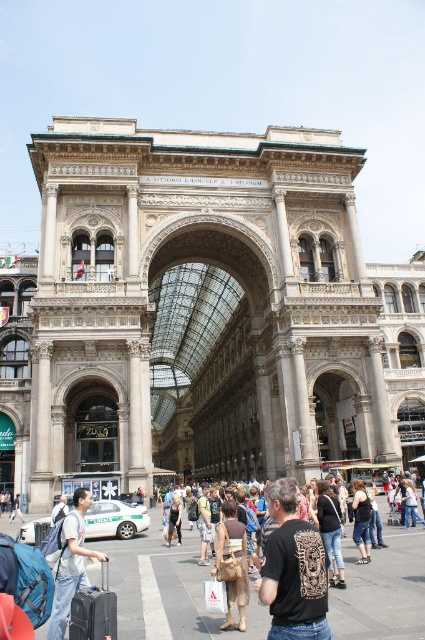
Question: Does brown leather bag at center appear on the left side of denim jeans at center?

Choices:
 (A) yes
 (B) no

Answer: (A)

Question: In this image, where is brown leather bag at center located relative to black leather jacket at center?

Choices:
 (A) right
 (B) left

Answer: (A)

Question: Based on their relative distances, which object is nearer to the matte black crowd at center?

Choices:
 (A) black cotton tank top at center
 (B) brown leather bag at center
 (C) black hard suitcase at lower left

Answer: (B)

Question: Based on their relative distances, which object is nearer to the black cotton tank top at center?

Choices:
 (A) denim jeans at center
 (B) brown leather bag at center
 (C) black hard suitcase at lower left
 (D) matte black crowd at center

Answer: (A)

Question: Can you confirm if black hard suitcase at lower left is positioned to the right of black cotton tank top at center?

Choices:
 (A) no
 (B) yes

Answer: (A)

Question: Which of these objects is positioned closest to the matte black crowd at center?

Choices:
 (A) denim jeans at center
 (B) brown leather bag at center

Answer: (A)